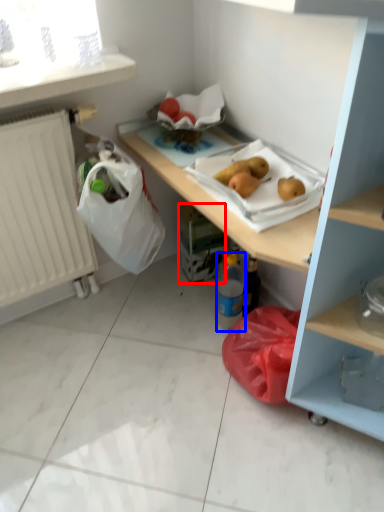
Question: Which object appears closest to the camera in this image, carton (highlighted by a red box) or bottle (highlighted by a blue box)?

Choices:
 (A) carton
 (B) bottle

Answer: (B)